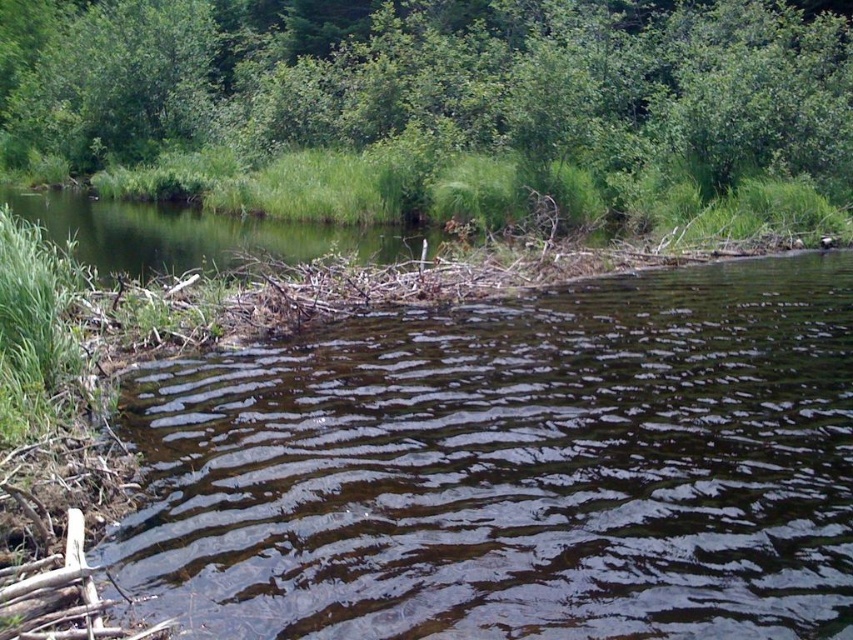
Question: Is brown/textured water at center to the right of green leafy tree at upper center from the viewer's perspective?

Choices:
 (A) no
 (B) yes

Answer: (B)

Question: Which object is closer to the camera taking this photo?

Choices:
 (A) green leafy tree at upper center
 (B) green grassy river at upper left
 (C) brown/textured water at center

Answer: (C)

Question: Is green leafy tree at upper center smaller than green grassy river at upper left?

Choices:
 (A) yes
 (B) no

Answer: (B)

Question: Which object is positioned farthest from the green leafy tree at upper center?

Choices:
 (A) green grassy river at upper left
 (B) brown/textured water at center

Answer: (B)

Question: Which of the following is the closest to the observer?

Choices:
 (A) brown/textured water at center
 (B) green leafy tree at upper center
 (C) green grassy river at upper left

Answer: (A)

Question: Can you confirm if brown/textured water at center is bigger than green leafy tree at upper center?

Choices:
 (A) yes
 (B) no

Answer: (B)